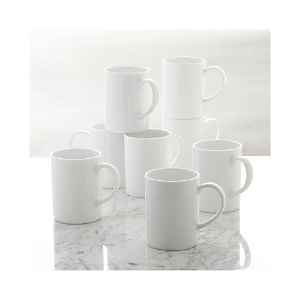
Where is `white mug handles`? The height and width of the screenshot is (300, 300). white mug handles is located at coordinates (115, 171), (75, 136), (154, 97), (179, 143), (220, 92), (219, 127), (248, 168), (222, 197).